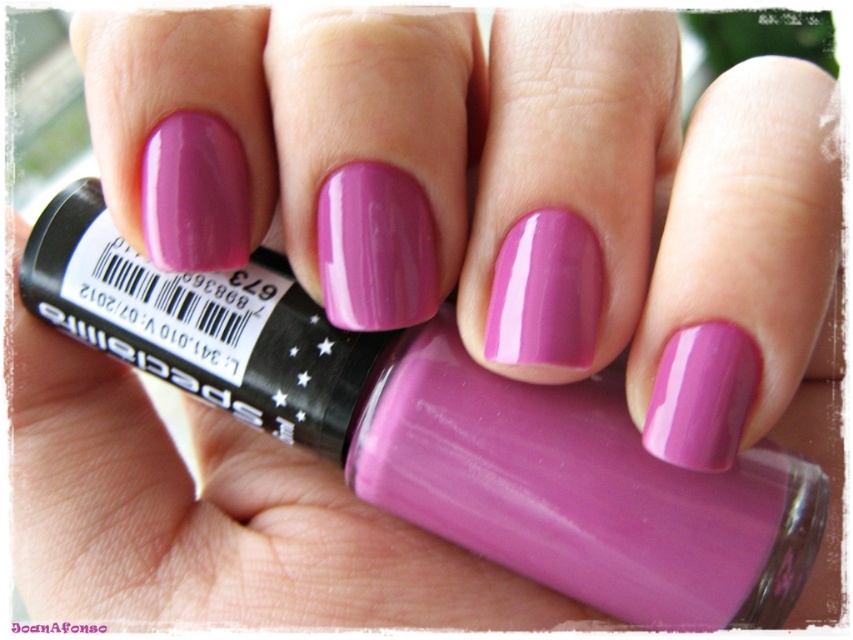
Can you confirm if matte purple nail polish at center is positioned to the left of glossy purple nail polish at center?

Incorrect, matte purple nail polish at center is not on the left side of glossy purple nail polish at center.

Measure the distance between point (164, 372) and camera.

18.72 inches

Where is `matte purple nail polish at center`? This screenshot has height=640, width=853. matte purple nail polish at center is located at coordinates (447, 433).